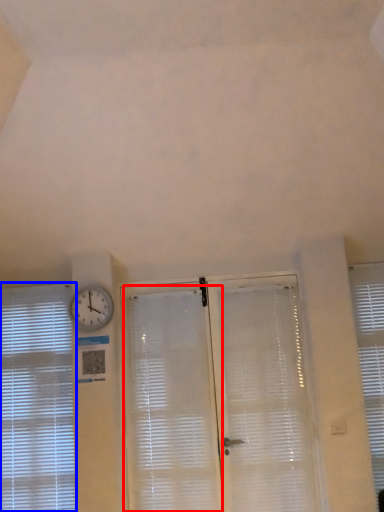
Question: Which point is closer to the camera, shutter (highlighted by a red box) or window blind (highlighted by a blue box)?

Choices:
 (A) shutter
 (B) window blind

Answer: (A)